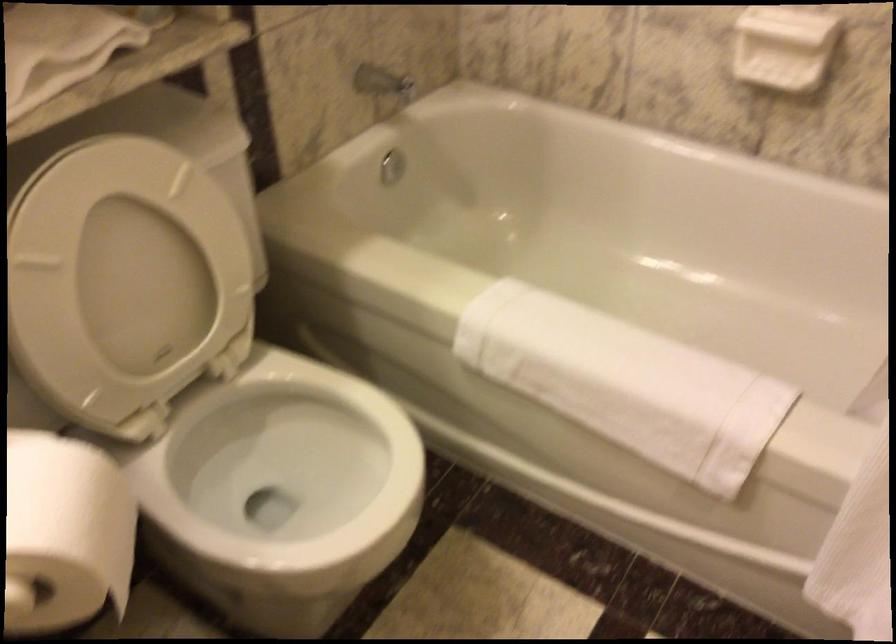
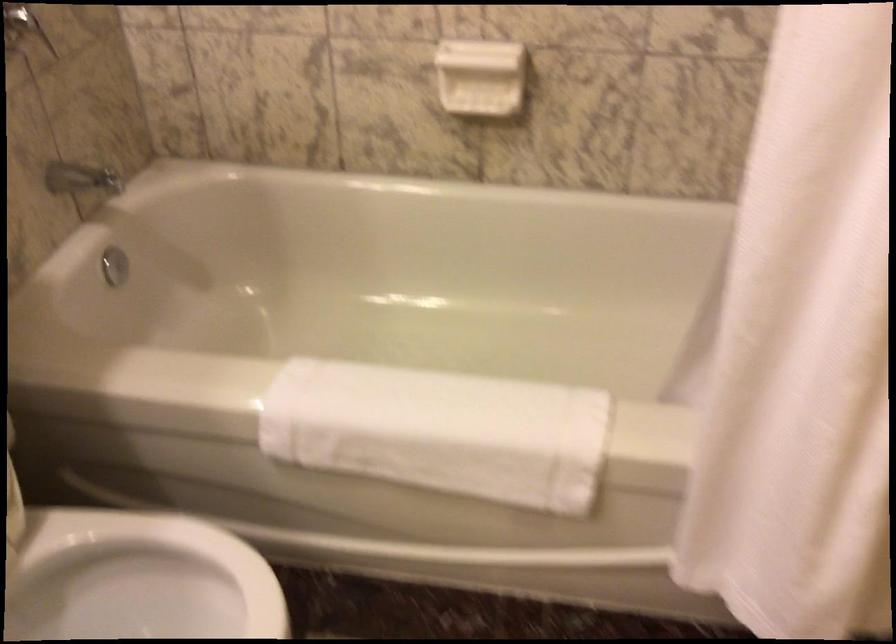
The images are taken continuously from a first-person perspective. In which direction are you moving?

The cameraman walked toward left, forward.